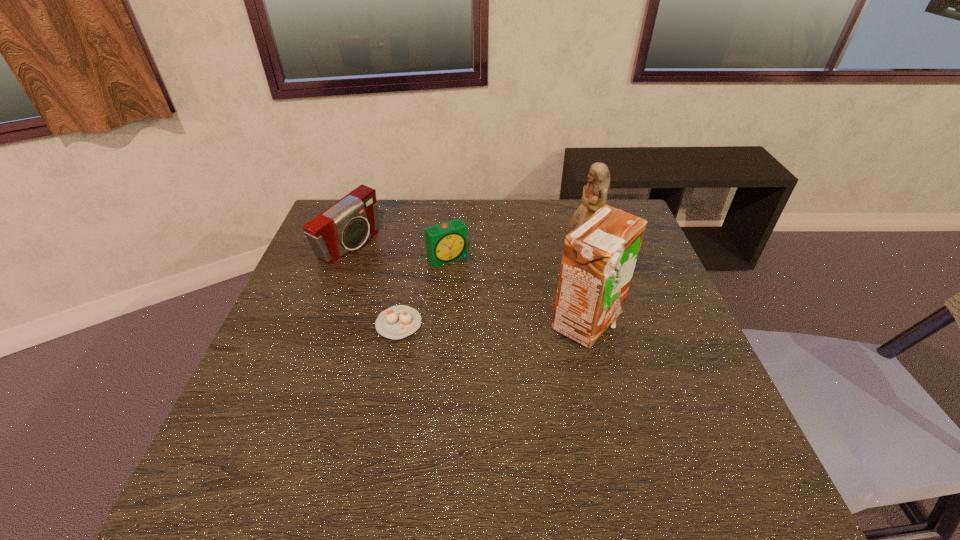
The image size is (960, 540). Find the location of `vacant spot on the desktop that is between the shortest object and the carton and is positioned on the front-facing side of the second shortest object`. vacant spot on the desktop that is between the shortest object and the carton and is positioned on the front-facing side of the second shortest object is located at coordinates (498, 324).

You are a GUI agent. You are given a task and a screenshot of the screen. Output one action in this format:
    pyautogui.click(x=<x>, y=<y>)
    Task: Click on the free spot on the desktop that is between the shortest object and the carton and is positioned on the front-facing side of the figurine
    Image resolution: width=960 pixels, height=540 pixels.
    Given the screenshot: What is the action you would take?
    pyautogui.click(x=510, y=324)

I want to click on vacant space on the desktop that is between the shortest object and the carton and is positioned on the front-facing side of the leftmost object, so click(500, 324).